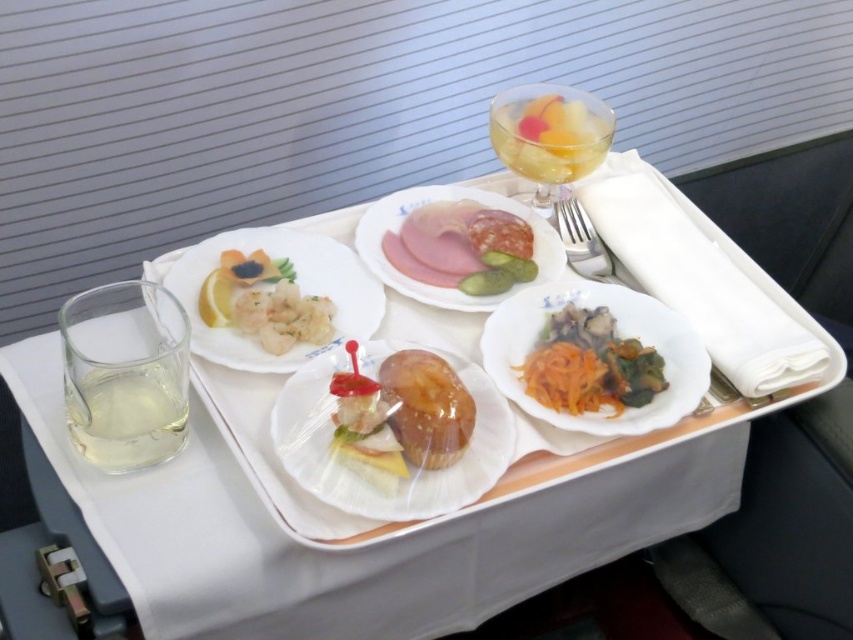
Based on the photo, is white glossy shrimp at upper left further to the viewer compared to sliced ham and salami at center?

That is False.

Which is more to the left, white glossy shrimp at upper left or sliced ham and salami at center?

From the viewer's perspective, white glossy shrimp at upper left appears more on the left side.

Between point (283, 330) and point (398, 276), which one is positioned in front?

Point (283, 330) is in front.

Identify the location of white glossy shrimp at upper left. (263, 301).

Can you confirm if translucent glass cup at lower left is shorter than shiny orange shredded carrots at center?

No.

Which is behind, point (122, 458) or point (614, 369)?

The point (614, 369) is more distant.

Find the location of `translucent glass cup at lower left`. translucent glass cup at lower left is located at coordinates (128, 412).

Is translucent glass wine glass at upper right bigger than translucent plastic sandwich at center?

Yes.

How distant is translucent glass wine glass at upper right from translucent plastic sandwich at center?

translucent glass wine glass at upper right is 13.48 inches away from translucent plastic sandwich at center.

Find the location of a particular element. The image size is (853, 640). translucent glass wine glass at upper right is located at coordinates (549, 134).